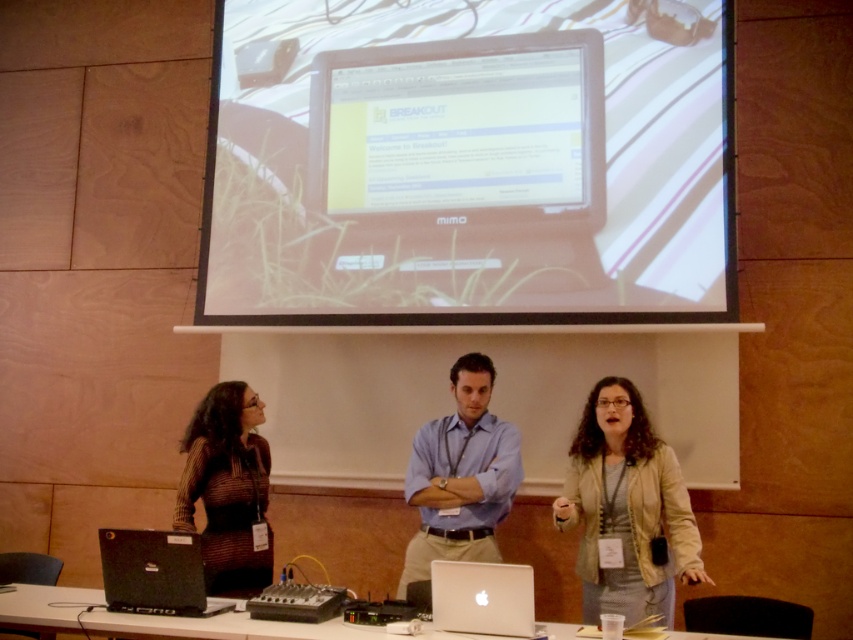
You are organizing a conference and need to place a name tag for the presenter at the blue shirt at center. According to the image, what are the coordinates where you should place the name tag?

The coordinates for the blue shirt at center are at point (460, 476), so you should place the name tag there.

You are organizing a presentation in the conference room and need to place a name tag for the presenter. The presenter is wearing a blue shirt and is located at point (460, 476). Where should you place the name tag?

The blue shirt at center is located at point (460, 476), so the name tag should be placed at that coordinate.